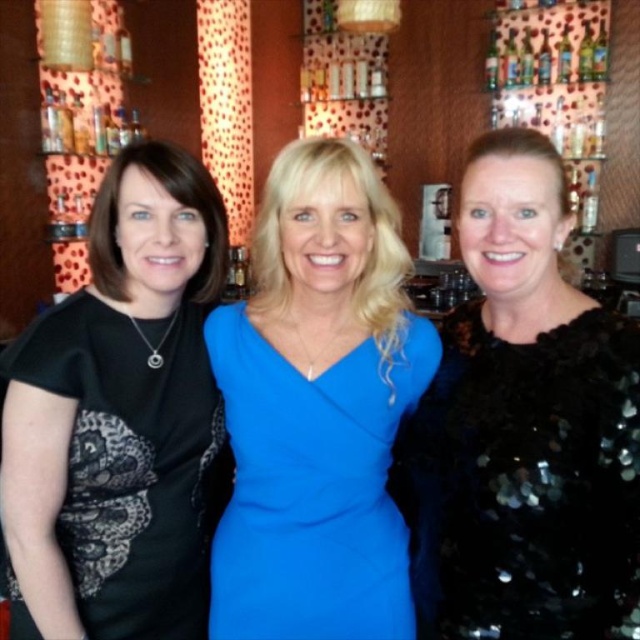
You are standing at the point marked as point [164,582] in a bar setting. You need to reach the door located 4.01 feet away from your current position. Can you walk straight ahead without any obstacles in your path?

The distance between point [164,582] and the viewer is 4.01 feet, so if the door is located exactly at the viewer position, you can walk straight ahead as there are no obstacles mentioned in the scene description.

You are a photographer setting up a camera to take a group photo of the black sequined dress at right and black matte shirt at left. The camera has a minimum focus distance of 20 inches. Will you be able to focus on both subjects simultaneously?

The black sequined dress at right and black matte shirt at left are 20.72 inches apart. Since the distance between them is greater than the camera minimum focus distance of 20 inches, the camera can focus on both subjects simultaneously.

You are taking a photo of the scene and want to focus on both the point at location (410, 460) and the point at (241, 508). Which point should you focus on first to ensure both are in focus?

You should focus on point (410, 460) first because it is closer to the camera than point (241, 508). This ensures that both points will be in focus as the focus will extend from the closer point to the further one.